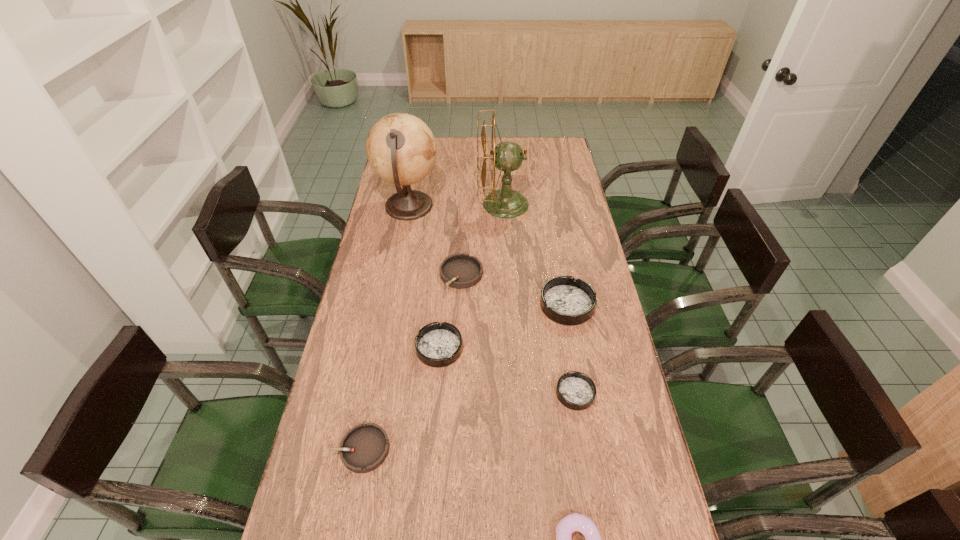
Where is `the smallest dark ashtray`? This screenshot has height=540, width=960. the smallest dark ashtray is located at coordinates (575, 390).

Where is `free location located 0.380m in front of the fan, directing air flow`? The image size is (960, 540). free location located 0.380m in front of the fan, directing air flow is located at coordinates (387, 204).

Find the location of a particular element. This screenshot has width=960, height=540. free space located in front of the fan, directing air flow is located at coordinates (432, 204).

Identify the location of free spot located 0.390m in front of the fan, directing air flow. (385, 204).

At what (x,y) coordinates should I click in order to perform the action: click on vacant region located 0.300m on the front-facing side of the globe. Please return your answer as a coordinate pair (x, y). Looking at the image, I should click on (513, 207).

Locate an element on the screen. This screenshot has height=540, width=960. vacant area located on the left of the farthest dark ashtray is located at coordinates (447, 305).

The height and width of the screenshot is (540, 960). Identify the location of vacant space situated 0.290m on the right of the farther gray ashtray. (564, 275).

The image size is (960, 540). Find the location of `vacant space situated on the left of the leftmost dark ashtray`. vacant space situated on the left of the leftmost dark ashtray is located at coordinates (373, 348).

Identify the location of free space located 0.370m on the back of the smaller gray ashtray. (387, 318).

Locate an element on the screen. This screenshot has width=960, height=540. vacant region located on the left of the fourth farthest ashtray is located at coordinates (x=474, y=393).